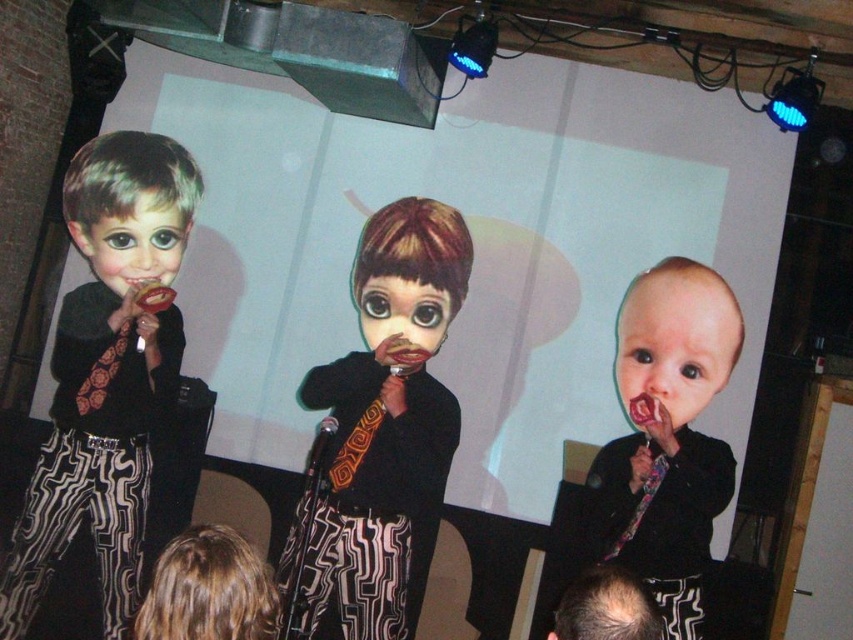
Question: Which point is farther to the camera?

Choices:
 (A) (569, 628)
 (B) (688, 344)
 (C) (451, 301)
 (D) (660, 320)

Answer: (C)

Question: Does smooth skin baby at center have a greater width compared to smooth bald head at lower center?

Choices:
 (A) yes
 (B) no

Answer: (A)

Question: Is matte black dress at center bigger than matte black suit at center?

Choices:
 (A) yes
 (B) no

Answer: (A)

Question: Which of the following is the farthest from the observer?

Choices:
 (A) (97, 532)
 (B) (654, 609)
 (C) (171, 234)

Answer: (C)

Question: Estimate the real-world distances between objects in this image. Which object is farther from the matte black suit at left?

Choices:
 (A) matte black dress at center
 (B) smooth bald head at lower center
 (C) smooth skin baby at center
 (D) matte black suit at center

Answer: (B)

Question: Can you confirm if matte black dress at center is positioned below matte plastic doll at center?

Choices:
 (A) yes
 (B) no

Answer: (A)